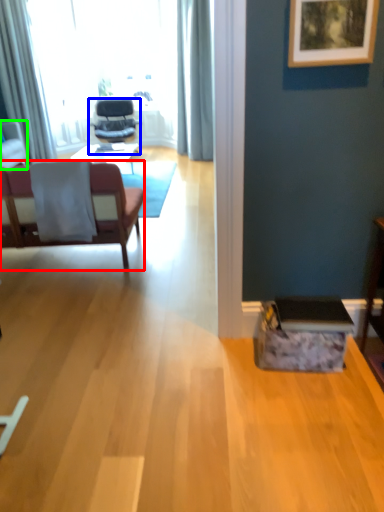
Question: Based on their relative distances, which object is farther from chair (highlighted by a red box)? Choose from chair (highlighted by a blue box) and chair (highlighted by a green box).

Choices:
 (A) chair
 (B) chair

Answer: (A)